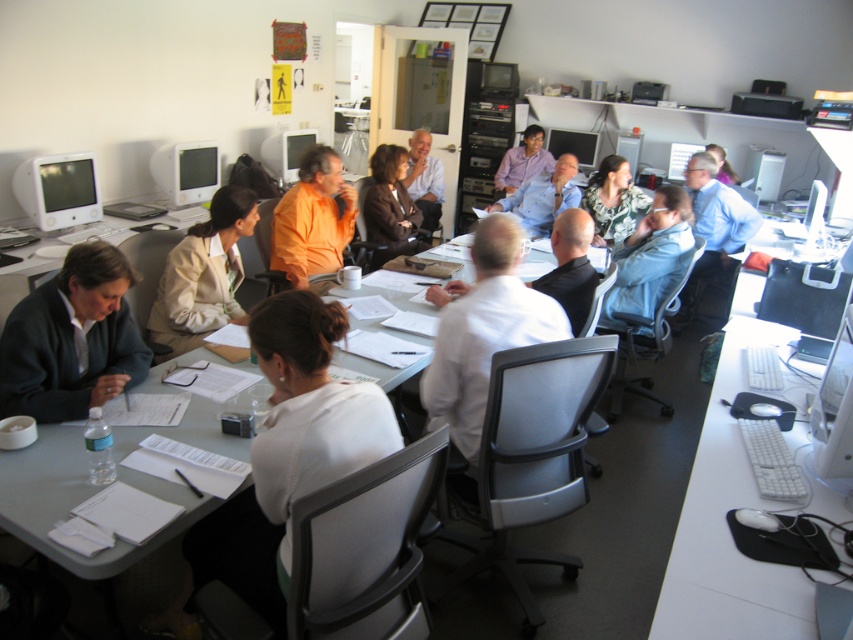
Is blue denim jacket at center bigger than matte black monitor at upper right?

Yes, blue denim jacket at center is bigger than matte black monitor at upper right.

Can you confirm if blue denim jacket at center is positioned above matte black monitor at upper right?

No, blue denim jacket at center is not above matte black monitor at upper right.

Is point (625, 276) behind point (680, 177)?

No, it is not.

The width and height of the screenshot is (853, 640). Find the location of `blue denim jacket at center`. blue denim jacket at center is located at coordinates (650, 256).

Does orange shirt at center appear on the right side of matte black monitor at upper center?

In fact, orange shirt at center is to the left of matte black monitor at upper center.

Can you confirm if orange shirt at center is positioned to the left of matte black monitor at upper center?

Indeed, orange shirt at center is positioned on the left side of matte black monitor at upper center.

Which is in front, point (309, 172) or point (560, 145)?

Point (309, 172) is in front.

Locate an element on the screen. orange shirt at center is located at coordinates point(312,218).

How much distance is there between beige fabric jacket at center and orange shirt at center?

A distance of 21.07 inches exists between beige fabric jacket at center and orange shirt at center.

Image resolution: width=853 pixels, height=640 pixels. I want to click on beige fabric jacket at center, so click(202, 275).

Who is more distant from viewer, (186, 333) or (274, 244)?

Point (274, 244)

You are a GUI agent. You are given a task and a screenshot of the screen. Output one action in this format:
    pyautogui.click(x=<x>, y=<y>)
    Task: Click on the beige fabric jacket at center
    This screenshot has height=640, width=853.
    Given the screenshot: What is the action you would take?
    pyautogui.click(x=202, y=275)